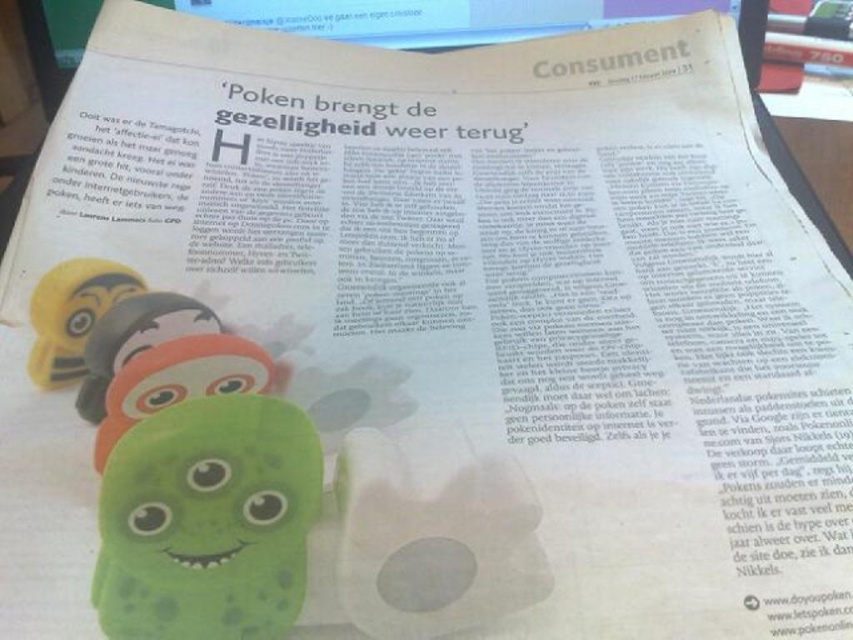
Can you confirm if green rubber toy at lower left is positioned to the left of green rubber caterpillar at lower left?

No, green rubber toy at lower left is not to the left of green rubber caterpillar at lower left.

Does point (248, 570) come in front of point (219, 323)?

Yes, point (248, 570) is in front of point (219, 323).

Between point (262, 438) and point (146, 326), which one is positioned behind?

Positioned behind is point (146, 326).

Where is `green rubber toy at lower left`? green rubber toy at lower left is located at coordinates (207, 522).

Is point (228, 356) positioned after point (102, 413)?

Yes, point (228, 356) is behind point (102, 413).

Based on the photo, who is more distant from viewer, [112,396] or [106,314]?

Positioned behind is point [106,314].

Identify the location of green rubber toy at center. The image size is (853, 640). (178, 380).

Describe the element at coordinates (73, 314) in the screenshot. The image size is (853, 640). I see `matte yellow toy at left` at that location.

I want to click on matte yellow toy at left, so click(x=73, y=314).

Where is `matte yellow toy at left`? This screenshot has width=853, height=640. matte yellow toy at left is located at coordinates (73, 314).